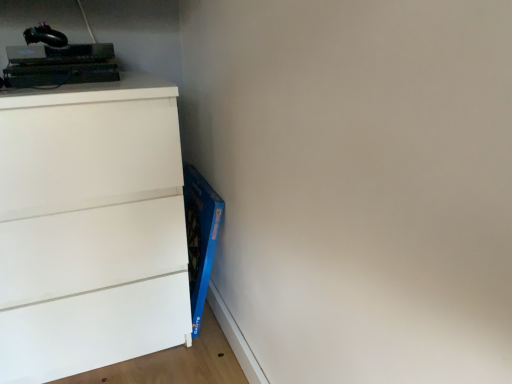
I want to click on blue cardboard box at lower right, so click(x=200, y=237).

This screenshot has height=384, width=512. What do you see at coordinates (200, 237) in the screenshot?
I see `blue cardboard box at lower right` at bounding box center [200, 237].

The height and width of the screenshot is (384, 512). What are the coordinates of `blue cardboard box at lower right` in the screenshot? It's located at (200, 237).